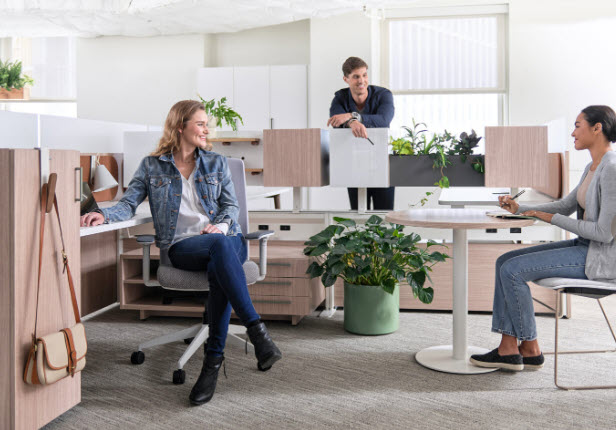
Identify the location of office. Image resolution: width=616 pixels, height=430 pixels. (310, 227).